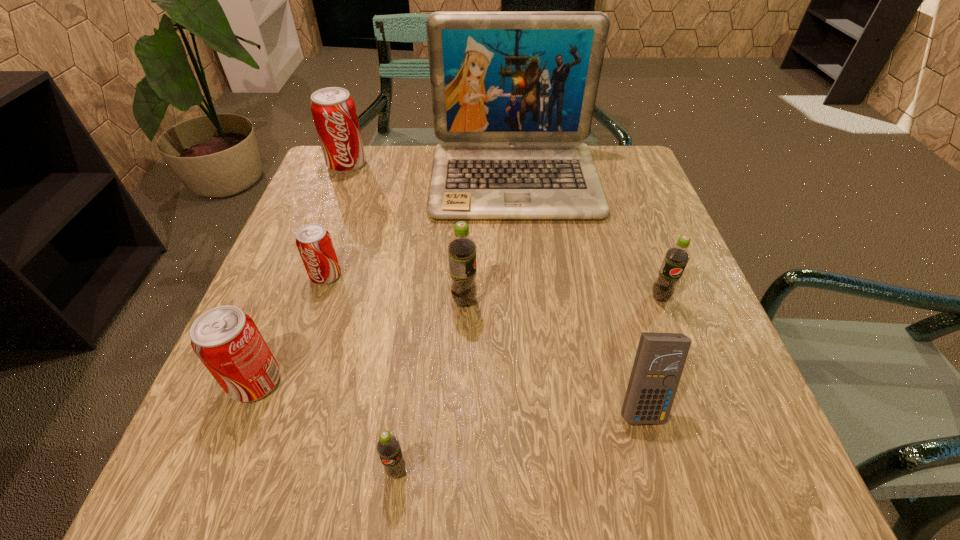
The height and width of the screenshot is (540, 960). In the image, there is a desktop. Identify the location of vacant area at the left edge. (305, 285).

I want to click on vacant space at the right edge of the desktop, so click(640, 197).

In order to click on vacant region at the far left corner of the desktop in this screenshot , I will do `click(379, 163)`.

In the image, there is a desktop. Where is `vacant space at the far right corner`? vacant space at the far right corner is located at coordinates (643, 188).

What are the coordinates of `blank region between the nearest soda and the biggest red soda can` in the screenshot? It's located at (372, 318).

I want to click on vacant area that lies between the tallest object and the second biggest green soda, so pos(588,239).

Locate an element on the screen. The width and height of the screenshot is (960, 540). unoccupied position between the calculator and the farthest red soda can is located at coordinates (494, 284).

The width and height of the screenshot is (960, 540). In order to click on vacant area between the smallest green soda and the farthest red soda can in this screenshot , I will do `click(372, 318)`.

The image size is (960, 540). I want to click on unoccupied position between the rightmost soda and the laptop computer, so coord(588,239).

The height and width of the screenshot is (540, 960). What are the coordinates of `empty location between the laptop computer and the nearest green soda` in the screenshot? It's located at (455, 325).